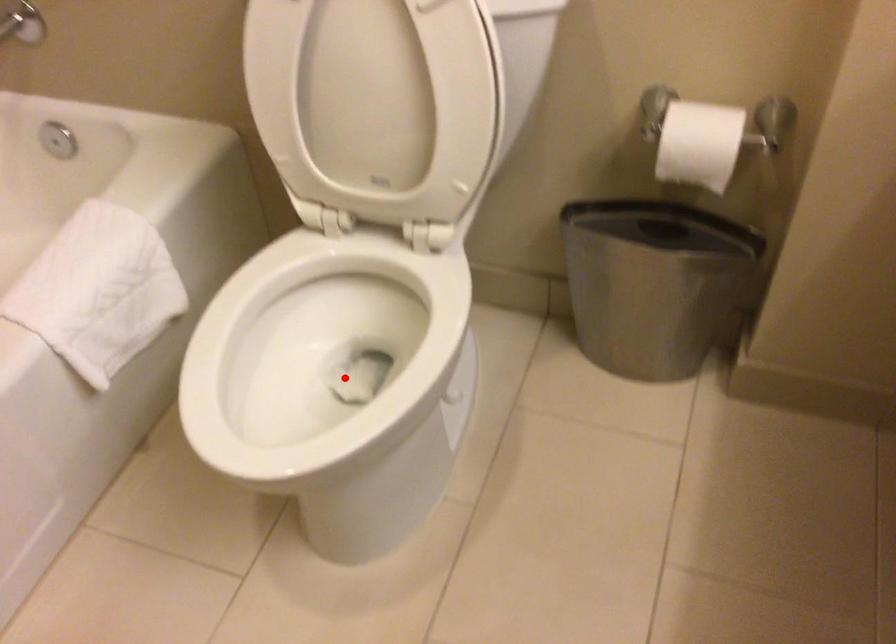
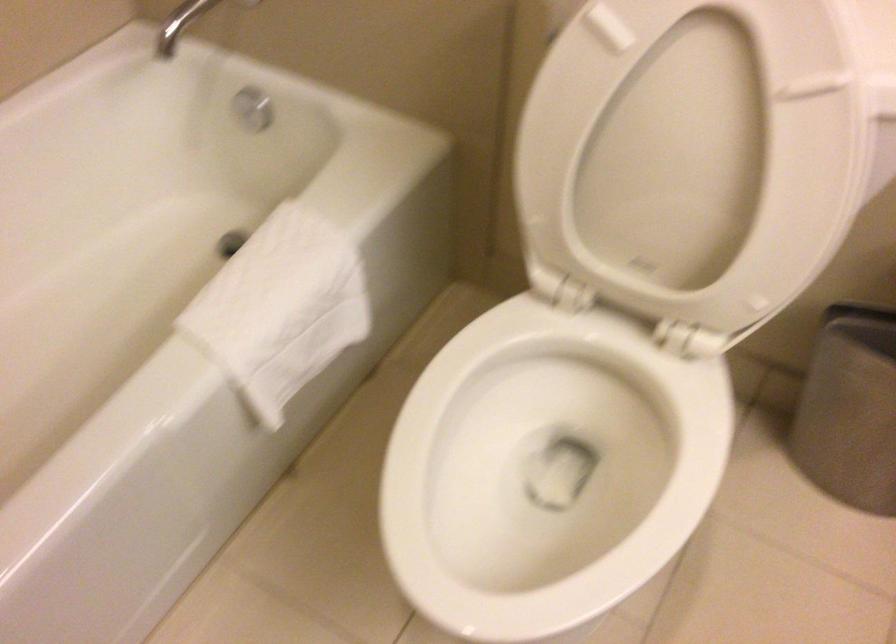
Question: I am providing you with two images of the same scene from different viewpoints. A red point is shown in image1. For the corresponding object point in image2, is it positioned nearer or farther from the camera?

Choices:
 (A) Nearer
 (B) Farther

Answer: (A)